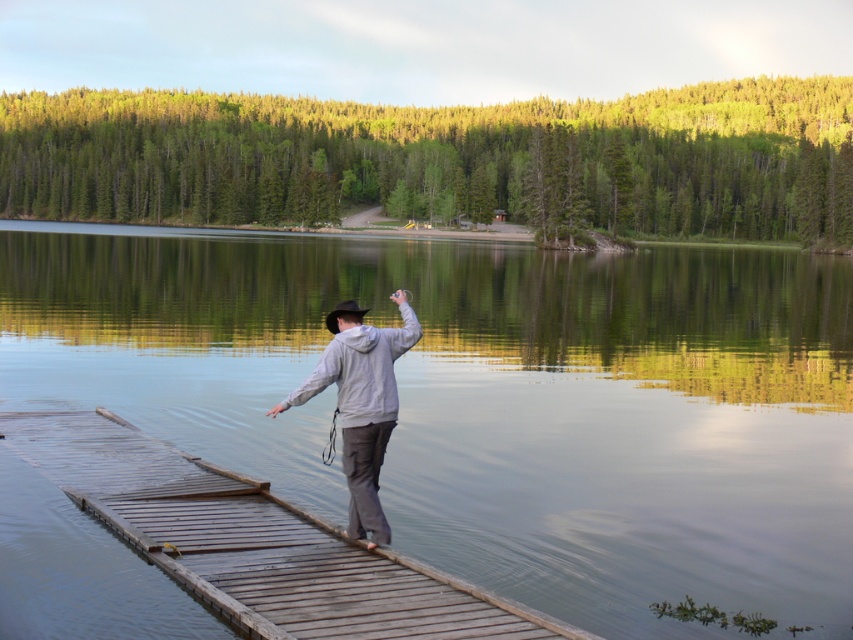
You are standing on the wooden dock and want to cast your fishing line into the smooth water at dock center. Based on the coordinates provided, where should you aim your cast relative to your current position?

The smooth water at dock center is located at coordinates point (491, 401), so you should aim your cast towards that specific point to reach the smooth water at dock center.

In the scene shown: You are standing on the wooden dock and want to place a small buoy between the smooth water at dock center and the gray matte hoodie at center. Based on their positions, which object should the buoy be closer to?

The smooth water at dock center is closer to the viewer than the gray matte hoodie at center, so the buoy should be placed closer to the smooth water at dock center.